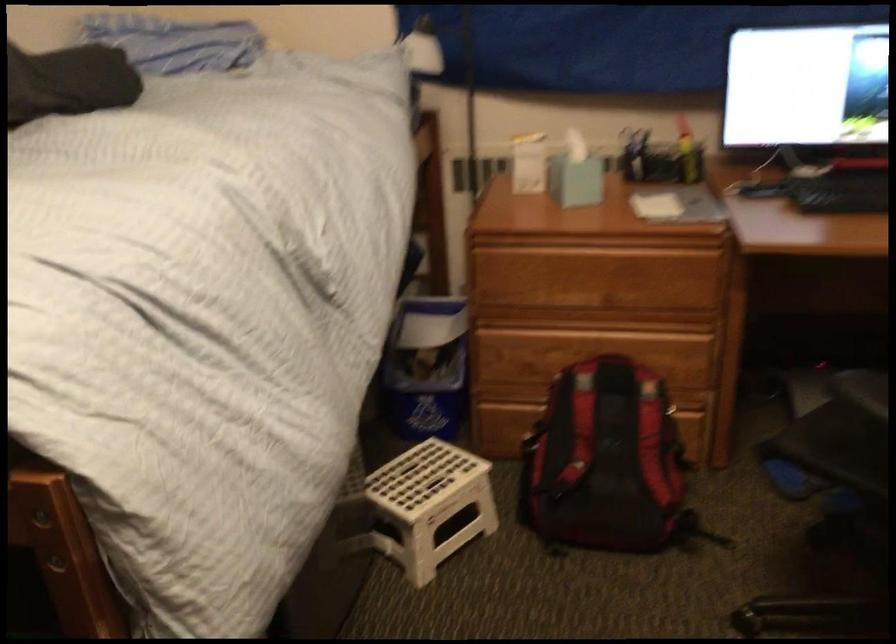
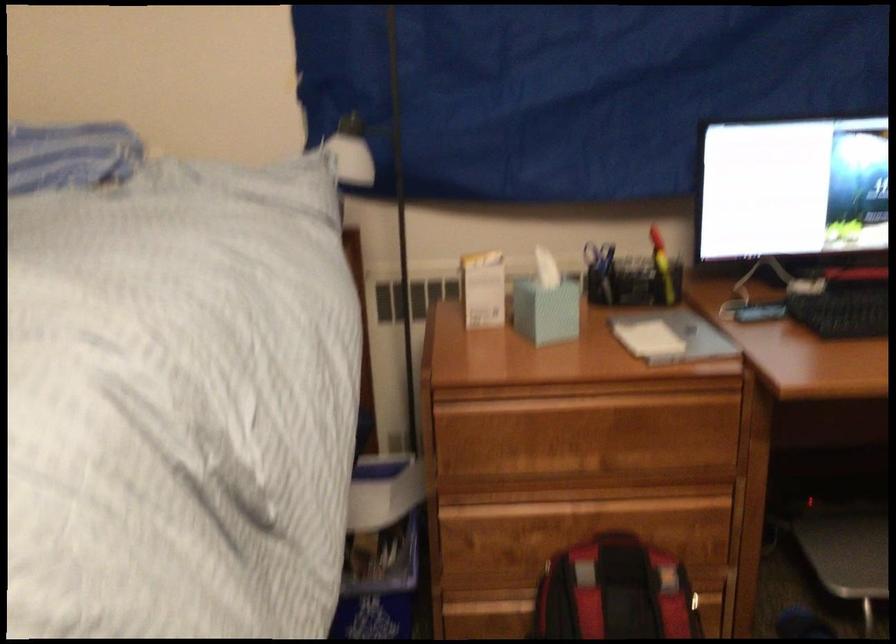
Find the pixel in the second image that matches pixel 578 146 in the first image.

(545, 270)